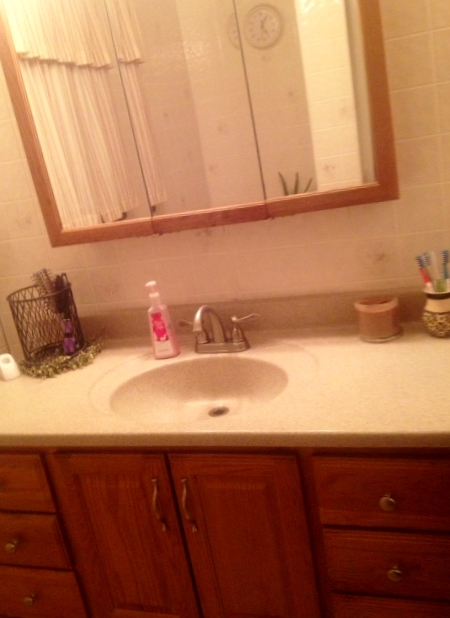
You are a GUI agent. You are given a task and a screenshot of the screen. Output one action in this format:
    pyautogui.click(x=<x>, y=<y>)
    Task: Click on the pink plastic soap dispenser
    Image resolution: width=450 pixels, height=618 pixels.
    Given the screenshot: What is the action you would take?
    pyautogui.click(x=148, y=311)